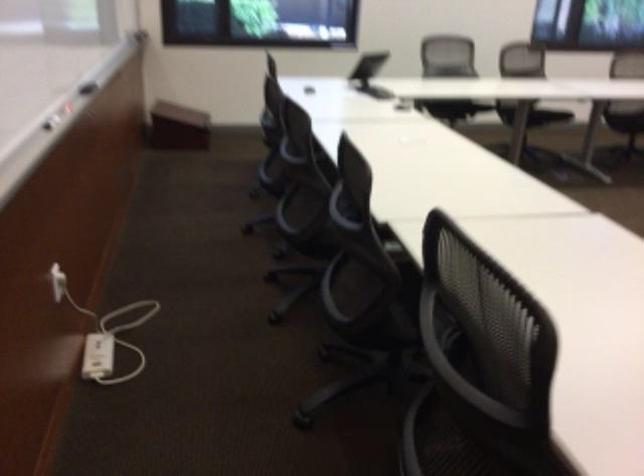
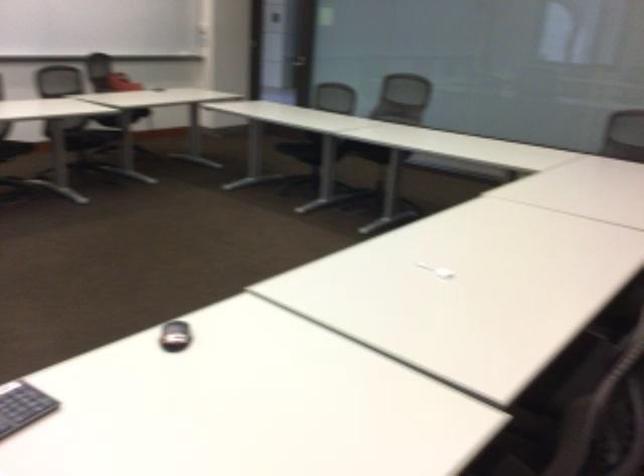
Based on the continuous images, in which direction is the camera rotating?

The rotation direction of the camera is right-down.